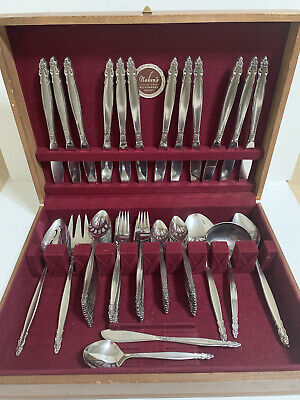
This screenshot has height=400, width=300. Find the location of `sets of knives`. sets of knives is located at coordinates (51, 93), (122, 104), (170, 105), (225, 107).